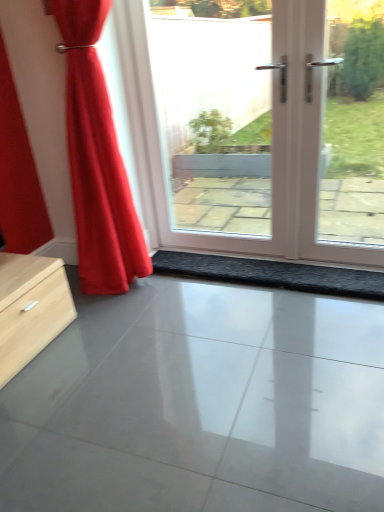
Where is `empty space that is ontop of glossy concrete floor at center (from a real-world perspective)`? The height and width of the screenshot is (512, 384). empty space that is ontop of glossy concrete floor at center (from a real-world perspective) is located at coordinates (180, 391).